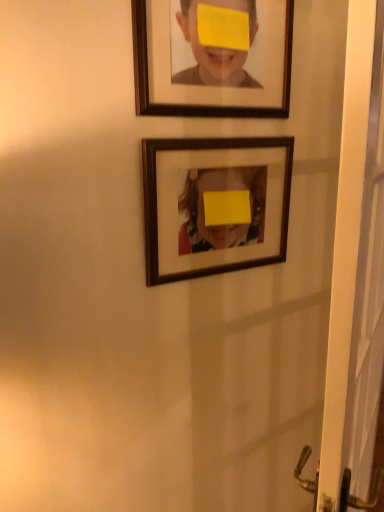
Find the location of a particular element. wooden frame at upper center, positioned as the first picture frame in top-to-bottom order is located at coordinates (212, 57).

Locate an element on the screen. The width and height of the screenshot is (384, 512). white plastic screen door at right is located at coordinates (355, 274).

Measure the distance between wooden frame at center, which is counted as the 1th picture frame, starting from the bottom, and white plastic screen door at right.

wooden frame at center, which is counted as the 1th picture frame, starting from the bottom, is 34.47 centimeters away from white plastic screen door at right.

Where is `screen door below the wooden frame at center, the second picture frame from the top (from the image's perspective)`? The height and width of the screenshot is (512, 384). screen door below the wooden frame at center, the second picture frame from the top (from the image's perspective) is located at coordinates (355, 274).

Does point (263, 169) come closer to viewer compared to point (362, 263)?

No, (263, 169) is further to viewer.

From the picture: In the image, is wooden frame at center, which is counted as the 1th picture frame, starting from the bottom, positioned in front of or behind white plastic screen door at right?

In the image, wooden frame at center, which is counted as the 1th picture frame, starting from the bottom, appears behind white plastic screen door at right.

Which object is thinner, white plastic screen door at right or wooden frame at center, the second picture frame from the top?

Thinner between the two is wooden frame at center, the second picture frame from the top.

Does white plastic screen door at right lie behind wooden frame at center, which is counted as the 1th picture frame, starting from the bottom?

No, white plastic screen door at right is in front of wooden frame at center, which is counted as the 1th picture frame, starting from the bottom.

In the scene shown: From the image's perspective, would you say white plastic screen door at right is shown under wooden frame at center, the second picture frame from the top?

Correct, white plastic screen door at right appears lower than wooden frame at center, the second picture frame from the top, in the image.

From the picture: Does white plastic screen door at right contain wooden frame at center, which is counted as the 1th picture frame, starting from the bottom?

No, wooden frame at center, which is counted as the 1th picture frame, starting from the bottom, is not inside white plastic screen door at right.

How many degrees apart are the facing directions of white plastic screen door at right and wooden frame at upper center, positioned as the first picture frame in top-to-bottom order?

The angular difference between white plastic screen door at right and wooden frame at upper center, positioned as the first picture frame in top-to-bottom order, is 31.5 degrees.

Which is farther from the camera, (x=377, y=103) or (x=180, y=100)?

The point (x=180, y=100) is farther.

Is white plastic screen door at right bigger or smaller than wooden frame at upper center, the 2th picture frame in the bottom-to-top sequence?

In the image, white plastic screen door at right appears to be larger than wooden frame at upper center, the 2th picture frame in the bottom-to-top sequence.

Considering the relative positions of white plastic screen door at right and wooden frame at upper center, the 2th picture frame in the bottom-to-top sequence, in the image provided, is white plastic screen door at right to the left of wooden frame at upper center, the 2th picture frame in the bottom-to-top sequence, from the viewer's perspective?

Incorrect, white plastic screen door at right is not on the left side of wooden frame at upper center, the 2th picture frame in the bottom-to-top sequence.

Does wooden frame at upper center, positioned as the first picture frame in top-to-bottom order, have a lesser width compared to white plastic screen door at right?

Correct, the width of wooden frame at upper center, positioned as the first picture frame in top-to-bottom order, is less than that of white plastic screen door at right.

From a real-world perspective, count 2nd picture frames upward from the white plastic screen door at right and point to it. Please provide its 2D coordinates.

[(212, 57)]

Considering the relative sizes of wooden frame at upper center, the 2th picture frame in the bottom-to-top sequence, and white plastic screen door at right in the image provided, is wooden frame at upper center, the 2th picture frame in the bottom-to-top sequence, taller than white plastic screen door at right?

Incorrect, the height of wooden frame at upper center, the 2th picture frame in the bottom-to-top sequence, is not larger of that of white plastic screen door at right.

From a real-world perspective, does wooden frame at upper center, positioned as the first picture frame in top-to-bottom order, sit lower than white plastic screen door at right?

No, from a real-world perspective, wooden frame at upper center, positioned as the first picture frame in top-to-bottom order, is not below white plastic screen door at right.

Between wooden frame at upper center, the 2th picture frame in the bottom-to-top sequence, and wooden frame at center, the second picture frame from the top, which one has less height?

wooden frame at upper center, the 2th picture frame in the bottom-to-top sequence.

In the scene shown: Can we say wooden frame at upper center, the 2th picture frame in the bottom-to-top sequence, lies outside wooden frame at center, the second picture frame from the top?

Indeed, wooden frame at upper center, the 2th picture frame in the bottom-to-top sequence, is completely outside wooden frame at center, the second picture frame from the top.

Based on their sizes in the image, would you say wooden frame at upper center, the 2th picture frame in the bottom-to-top sequence, is bigger or smaller than wooden frame at center, the second picture frame from the top?

wooden frame at upper center, the 2th picture frame in the bottom-to-top sequence, is smaller than wooden frame at center, the second picture frame from the top.

Is wooden frame at upper center, the 2th picture frame in the bottom-to-top sequence, in contact with wooden frame at center, which is counted as the 1th picture frame, starting from the bottom?

No, wooden frame at upper center, the 2th picture frame in the bottom-to-top sequence, is not beside wooden frame at center, which is counted as the 1th picture frame, starting from the bottom.

From the image's perspective, is wooden frame at center, which is counted as the 1th picture frame, starting from the bottom, located beneath wooden frame at upper center, positioned as the first picture frame in top-to-bottom order?

Yes.

From a real-world perspective, is wooden frame at center, the second picture frame from the top, located beneath wooden frame at upper center, positioned as the first picture frame in top-to-bottom order?

Yes, from a real-world perspective, wooden frame at center, the second picture frame from the top, is beneath wooden frame at upper center, positioned as the first picture frame in top-to-bottom order.

Between wooden frame at center, which is counted as the 1th picture frame, starting from the bottom, and wooden frame at upper center, the 2th picture frame in the bottom-to-top sequence, which one has more height?

With more height is wooden frame at center, which is counted as the 1th picture frame, starting from the bottom.

Where is `screen door to the right of wooden frame at center, which is counted as the 1th picture frame, starting from the bottom`? screen door to the right of wooden frame at center, which is counted as the 1th picture frame, starting from the bottom is located at coordinates (355, 274).

Locate an element on the screen. screen door in front of the wooden frame at center, which is counted as the 1th picture frame, starting from the bottom is located at coordinates coord(355,274).

Based on their spatial positions, is wooden frame at upper center, positioned as the first picture frame in top-to-bottom order, or white plastic screen door at right further from wooden frame at center, the second picture frame from the top?

white plastic screen door at right is further to wooden frame at center, the second picture frame from the top.

From the image, which object appears to be farther from wooden frame at upper center, the 2th picture frame in the bottom-to-top sequence, wooden frame at center, the second picture frame from the top, or white plastic screen door at right?

Among the two, white plastic screen door at right is located further to wooden frame at upper center, the 2th picture frame in the bottom-to-top sequence.

When comparing their distances from wooden frame at upper center, the 2th picture frame in the bottom-to-top sequence, does white plastic screen door at right or wooden frame at center, the second picture frame from the top, seem further?

white plastic screen door at right.

From the image, which object appears to be nearer to wooden frame at center, the second picture frame from the top, white plastic screen door at right or wooden frame at upper center, positioned as the first picture frame in top-to-bottom order?

Based on the image, wooden frame at upper center, positioned as the first picture frame in top-to-bottom order, appears to be nearer to wooden frame at center, the second picture frame from the top.

From the picture: From the image, which object appears to be farther from white plastic screen door at right, wooden frame at upper center, the 2th picture frame in the bottom-to-top sequence, or wooden frame at center, which is counted as the 1th picture frame, starting from the bottom?

wooden frame at upper center, the 2th picture frame in the bottom-to-top sequence, is further to white plastic screen door at right.

Considering their positions, is wooden frame at center, which is counted as the 1th picture frame, starting from the bottom, positioned closer to white plastic screen door at right than wooden frame at upper center, positioned as the first picture frame in top-to-bottom order?

wooden frame at center, which is counted as the 1th picture frame, starting from the bottom, lies closer to white plastic screen door at right than the other object.

I want to click on picture frame between wooden frame at upper center, the 2th picture frame in the bottom-to-top sequence, and white plastic screen door at right from top to bottom, so click(215, 205).